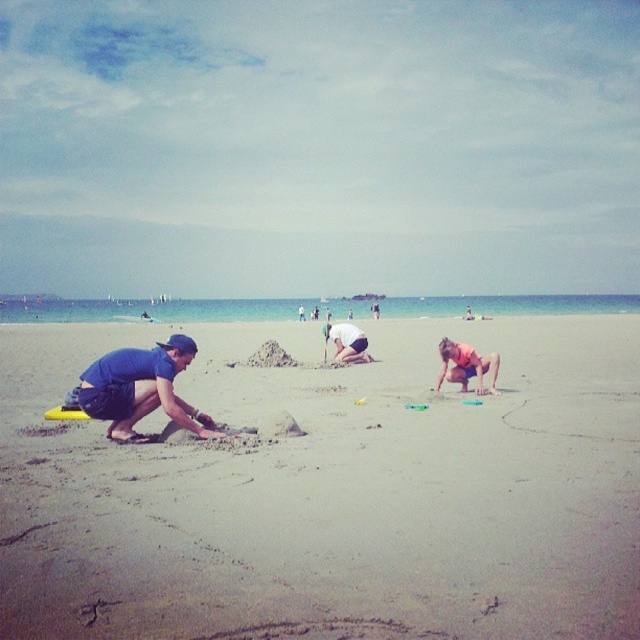
You are standing at the point with coordinates point (333, 323) and want to walk to the ocean. Which direction should you go to reach the ocean first, towards point (77, 400) or away from it?

You should go towards point (77, 400) because it is in front of point (333, 323), meaning it is closer to the ocean.

You are a photographer standing at the center of the beach scene. You want to capture a photo that includes both the orange fabric shorts at lower right and the person in a pink top kneeling. Where should you position your camera to ensure both subjects are in frame?

To include both the orange fabric shorts at lower right and the person in a pink top kneeling, position the camera slightly to the left of the orange fabric shorts at lower right since the pink top is to the left of it.